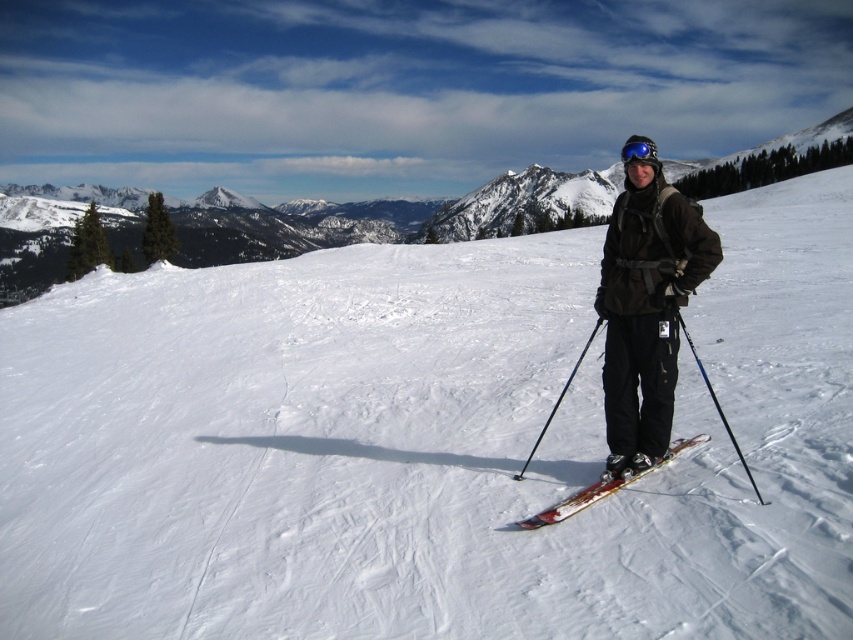
You are a photographer trying to capture the skier from behind. You notice the shiny metallic skis at center and the blue reflective goggles at center. Which object should appear closer to the camera in your photo?

The shiny metallic skis at center should appear closer to the camera because they are positioned in front of the blue reflective goggles at center.

Consider the image. You are a photographer trying to capture the skier in the image. You want to ensure both the blue metallic ski pole at center and the blue reflective goggles at center are clearly visible in your shot. Which object should you focus on to ensure it takes up more space in the photo?

The blue reflective goggles at center takes up more space than the blue metallic ski pole at center, so focusing on the blue reflective goggles at center will ensure it appears larger in the photo.

You are a photographer trying to capture the skier and their equipment. Based on the scene, can you determine which object is positioned to the right of the other between the white powder snow at center and the blue metallic ski pole at center?

The white powder snow at center is to the right of blue metallic ski pole at center according to the description.